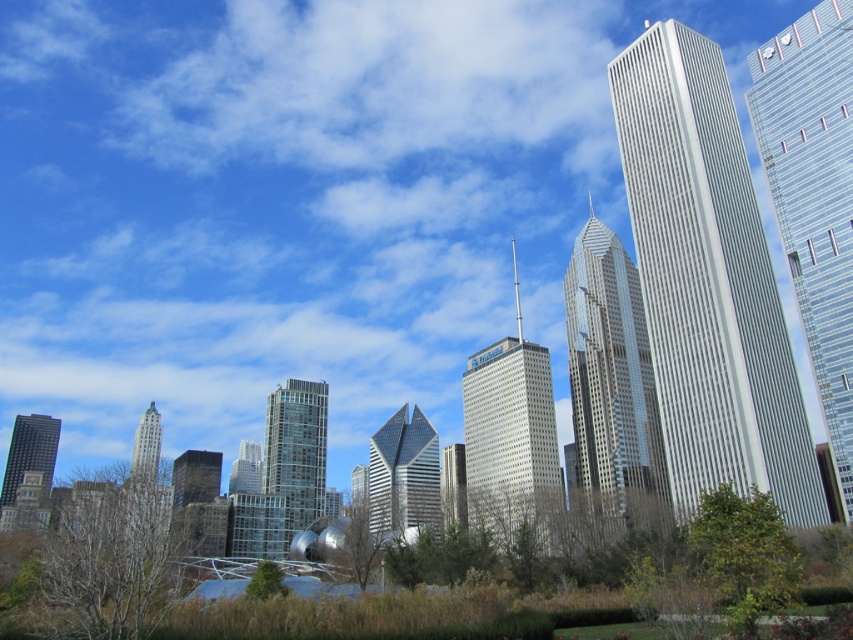
Question: Which of the following is the farthest from the observer?

Choices:
 (A) (264, 433)
 (B) (35, 419)

Answer: (B)

Question: Among these objects, which one is farthest from the camera?

Choices:
 (A) glassy steel skyscraper at center
 (B) transparent glass skyscraper at right
 (C) silver glass skyscraper at upper right
 (D) glassy reflective skyscraper at center

Answer: (D)

Question: In this image, where is gold reflective glass skyscraper at center located relative to green glass skyscraper at lower left?

Choices:
 (A) above
 (B) below

Answer: (A)

Question: Among these objects, which one is farthest from the camera?

Choices:
 (A) gold reflective glass skyscraper at center
 (B) green grass at lower center
 (C) matte glass skyscraper at lower left

Answer: (C)

Question: Is silver glass skyscraper at upper right thinner than green grass at lower center?

Choices:
 (A) no
 (B) yes

Answer: (B)

Question: In this image, where is transparent glass skyscraper at right located relative to glassy steel skyscraper at center?

Choices:
 (A) below
 (B) above

Answer: (B)